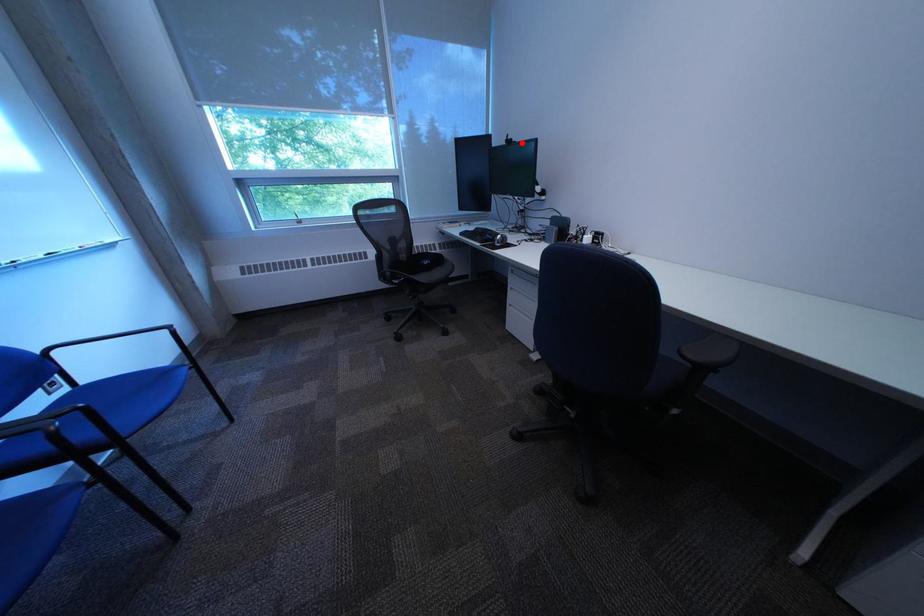
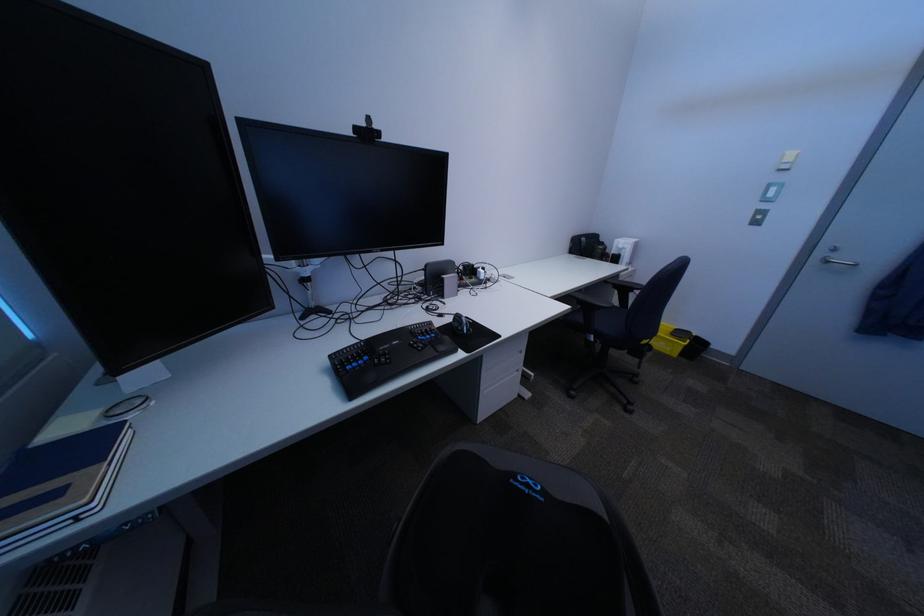
In the second image, find the point that corresponds to the highlighted location in the first image.

(371, 131)